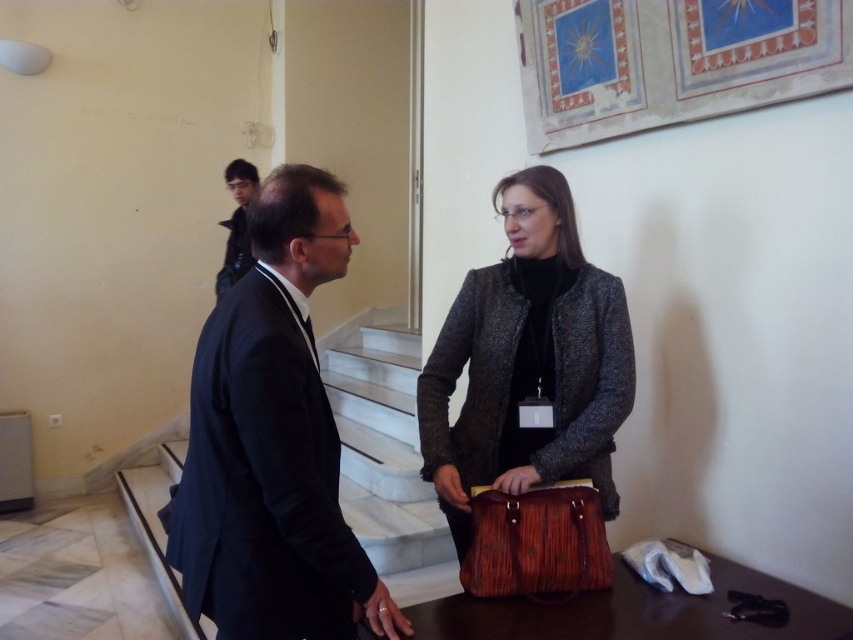
You are standing in the conference room and see two points marked on the wall. The first point is labeled as point (509,358) and the second is point (590,536). Which point is closer to you?

Point (509,358) is closer to you because it is further to the viewer than point (590,536).

You are standing in the middle of the room and see two points marked on the floor. The first point is at coordinate point(602, 296) and the second point is at coordinate point(242, 262). Which point is closer to you?

Point(602, 296) is in front of point(242, 262), so it is closer to you.

You are standing in the center of the room and want to move towards the black suit at center. Which direction should you move to reach it?

The black suit at center is located at point 0.691 on the x and 0.320 on the y coordinates. Since you are already at the center, you can move directly towards it without needing to adjust your direction significantly.